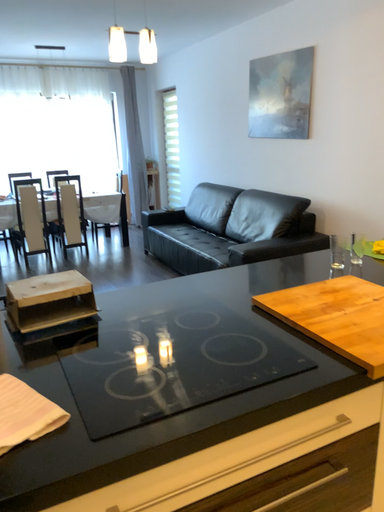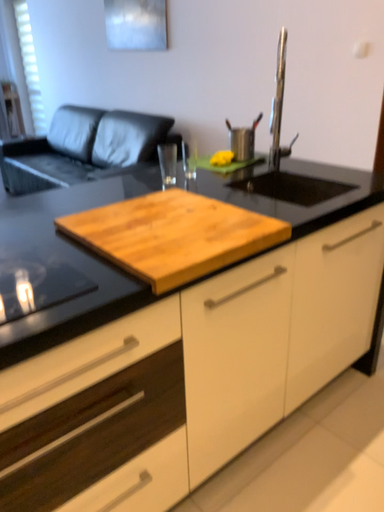
Question: Which way did the camera rotate in the video?

Choices:
 (A) rotated left
 (B) rotated right

Answer: (B)